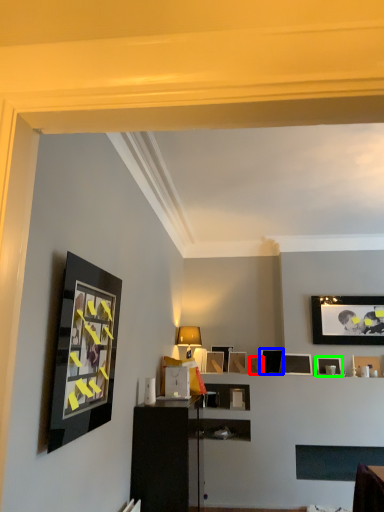
Question: Which is nearer to the picture frame (highlighted by a red box)? picture frame (highlighted by a blue box) or picture frame (highlighted by a green box).

Choices:
 (A) picture frame
 (B) picture frame

Answer: (A)